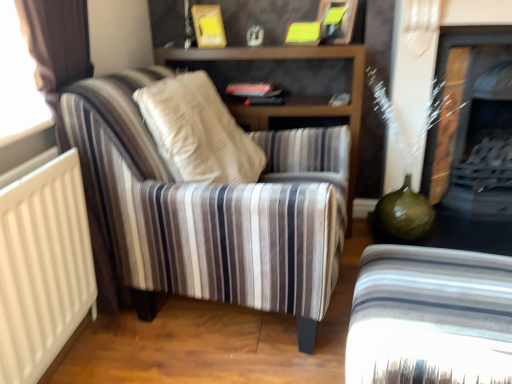
Question: Considering the relative positions of matte black fireplace at right and striped fabric armchair at lower right, the 1th chair from the right, in the image provided, is matte black fireplace at right behind striped fabric armchair at lower right, the 1th chair from the right,?

Choices:
 (A) no
 (B) yes

Answer: (B)

Question: Can you confirm if matte black fireplace at right is positioned to the right of striped fabric armchair at lower right, the 1th chair from the right?

Choices:
 (A) yes
 (B) no

Answer: (A)

Question: Is striped fabric armchair at lower right, the 1th chair from the right, inside matte black fireplace at right?

Choices:
 (A) no
 (B) yes

Answer: (A)

Question: From a real-world perspective, is matte black fireplace at right below striped fabric armchair at lower right, which is the 2th chair from left to right?

Choices:
 (A) yes
 (B) no

Answer: (B)

Question: Does matte black fireplace at right have a lesser height compared to striped fabric armchair at lower right, which is the 2th chair from left to right?

Choices:
 (A) yes
 (B) no

Answer: (B)

Question: Is matte black fireplace at right smaller than striped fabric armchair at lower right, the 1th chair from the right?

Choices:
 (A) yes
 (B) no

Answer: (B)

Question: Is striped fabric armchair at left, which is the 2th chair from right to left, completely or partially outside of matte black fireplace at right?

Choices:
 (A) no
 (B) yes

Answer: (B)

Question: Can you confirm if striped fabric armchair at left, which ranks as the 1th chair in left-to-right order, is positioned to the left of matte black fireplace at right?

Choices:
 (A) yes
 (B) no

Answer: (A)

Question: From a real-world perspective, is striped fabric armchair at left, which is the 2th chair from right to left, located beneath matte black fireplace at right?

Choices:
 (A) yes
 (B) no

Answer: (A)

Question: From a real-world perspective, is striped fabric armchair at left, which is the 2th chair from right to left, located higher than matte black fireplace at right?

Choices:
 (A) yes
 (B) no

Answer: (B)

Question: Is striped fabric armchair at left, which ranks as the 1th chair in left-to-right order, at the right side of matte black fireplace at right?

Choices:
 (A) no
 (B) yes

Answer: (A)

Question: Is striped fabric armchair at left, which is the 2th chair from right to left, thinner than matte black fireplace at right?

Choices:
 (A) no
 (B) yes

Answer: (A)

Question: Does striped fabric armchair at lower right, which is the 2th chair from left to right, appear on the left side of matte black fireplace at right?

Choices:
 (A) no
 (B) yes

Answer: (B)